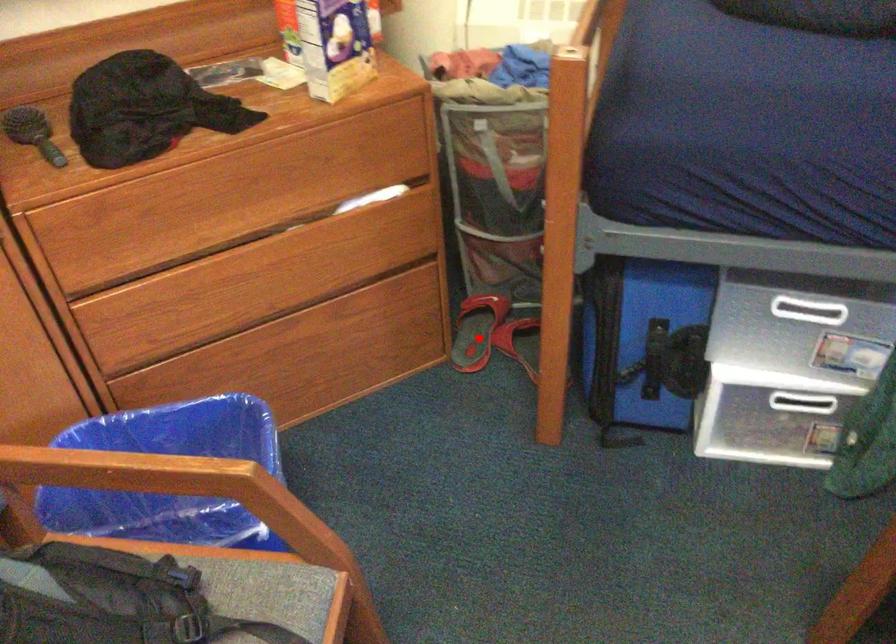
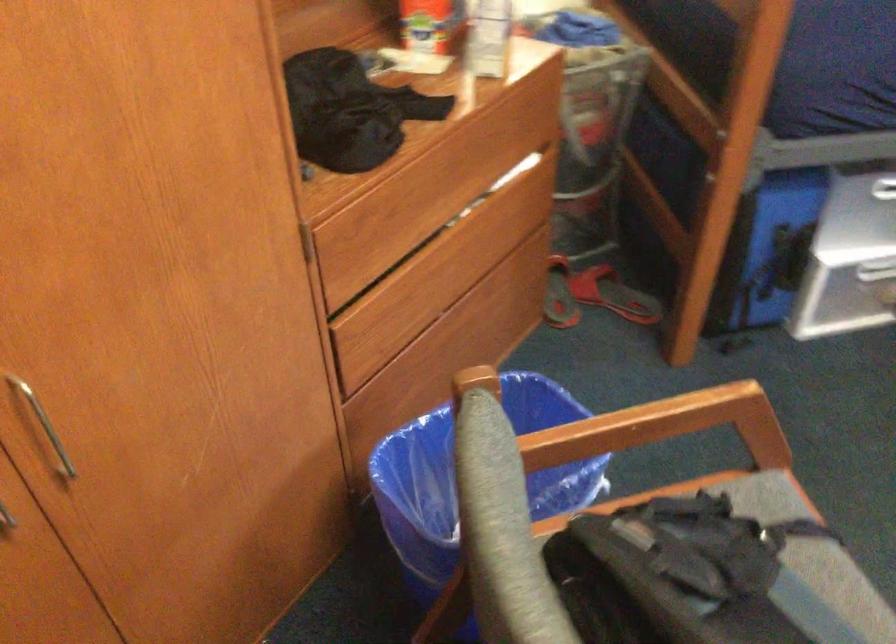
Locate, in the second image, the point that corresponds to the highlighted location in the first image.

(558, 295)